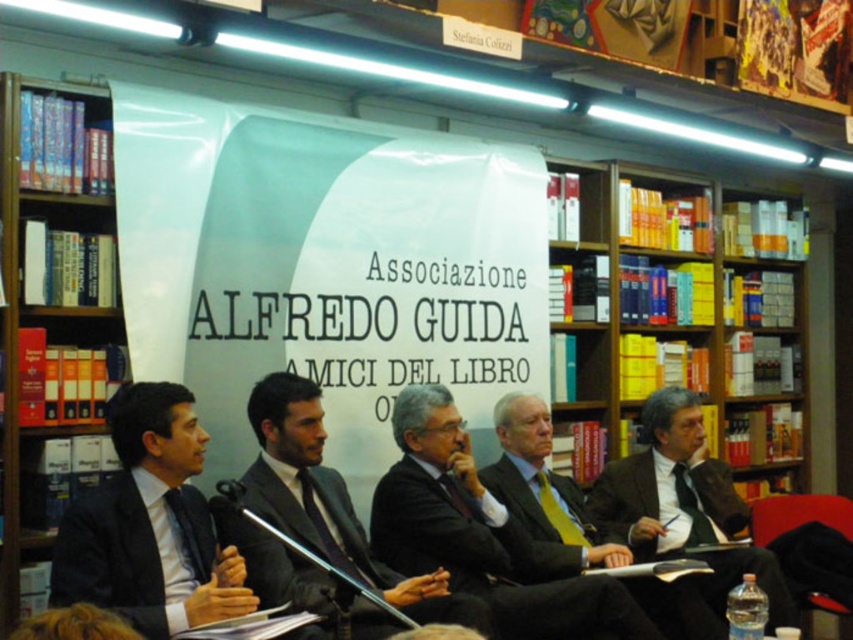
Question: Among these points, which one is farthest from the camera?

Choices:
 (A) (689, 467)
 (B) (403, 513)
 (C) (311, 536)

Answer: (A)

Question: Which object is closer to the camera taking this photo?

Choices:
 (A) dark suit at center
 (B) wooden bookshelf at left
 (C) matte black suit at center
 (D) dark brown suit at center

Answer: (A)

Question: Is dark brown suit at center closer to the viewer compared to matte black suit at center?

Choices:
 (A) no
 (B) yes

Answer: (B)

Question: Is wooden bookshelf at left behind black matte suit at center?

Choices:
 (A) no
 (B) yes

Answer: (A)

Question: Which point is farther from the camera taking this photo?

Choices:
 (A) (193, 541)
 (B) (10, 314)
 (C) (619, 508)

Answer: (C)

Question: Considering the relative positions of dark brown suit at center and matte black suit at center in the image provided, where is dark brown suit at center located with respect to matte black suit at center?

Choices:
 (A) right
 (B) left

Answer: (A)